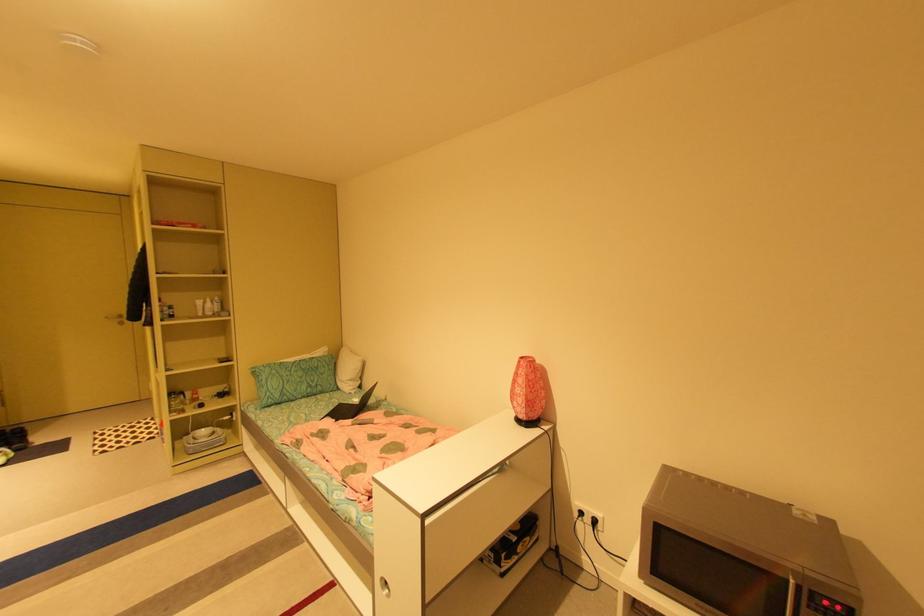
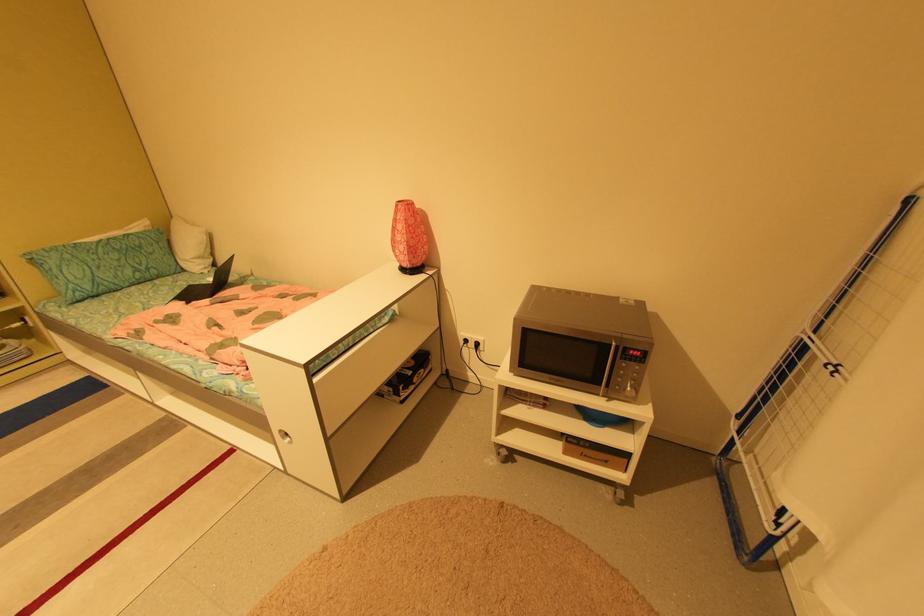
The point at (528, 358) is marked in the first image. Where is the corresponding point in the second image?

(406, 201)